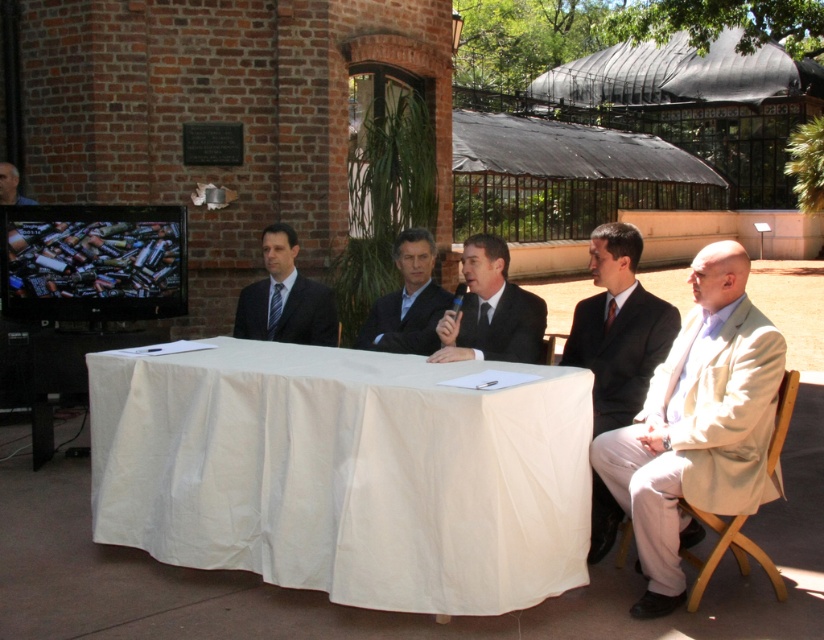
Does black matte suit at right appear on the right side of dark blue suit at center?

Yes, black matte suit at right is to the right of dark blue suit at center.

Based on the photo, can you confirm if black matte suit at right is taller than dark blue suit at center?

Correct, black matte suit at right is much taller as dark blue suit at center.

Which is behind, point (648, 369) or point (368, 316)?

The point (368, 316) is behind.

Image resolution: width=824 pixels, height=640 pixels. I want to click on black matte suit at right, so click(620, 352).

Does beige fabric suit at right appear under black suit at left?

Correct, beige fabric suit at right is located below black suit at left.

Between beige fabric suit at right and black suit at left, which one is positioned higher?

black suit at left is above.

Which is behind, point (728, 502) or point (237, 308)?

The point (237, 308) is behind.

You are a GUI agent. You are given a task and a screenshot of the screen. Output one action in this format:
    pyautogui.click(x=<x>, y=<y>)
    Task: Click on the beige fabric suit at right
    The height and width of the screenshot is (640, 824).
    Given the screenshot: What is the action you would take?
    pyautogui.click(x=696, y=426)

Which is below, black suit at left or dark blue suit at center?

black suit at left

Is point (307, 298) positioned before point (434, 328)?

No, (307, 298) is further to viewer.

Find the location of a particular element. This screenshot has width=824, height=640. black suit at left is located at coordinates (284, 298).